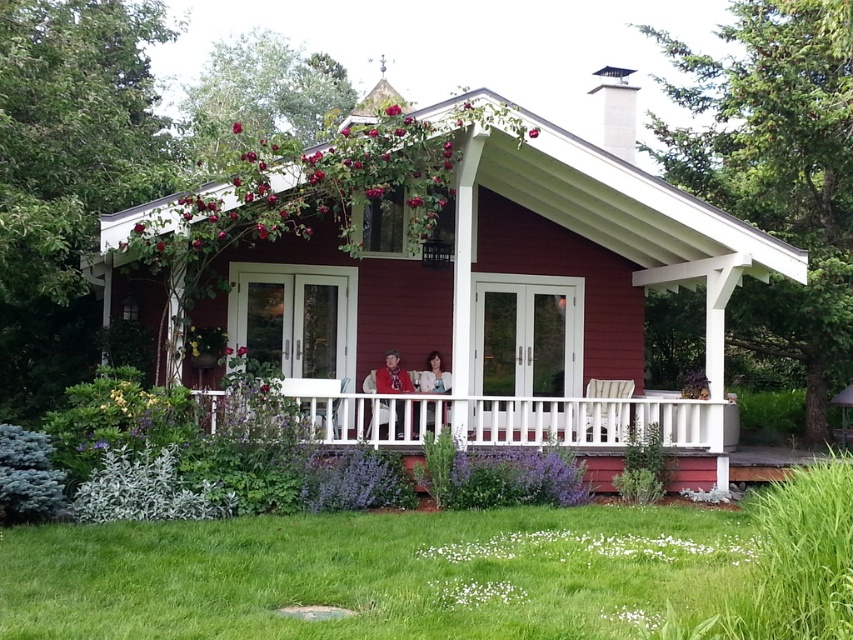
Question: Which of the following is the closest to the observer?

Choices:
 (A) red matte rose at center
 (B) white fluffy petals at lower center
 (C) green grass at lower center
 (D) white wooden porch at center

Answer: (C)

Question: Is white wooden porch at center bigger than smooth glossy rose at upper center?

Choices:
 (A) yes
 (B) no

Answer: (B)

Question: Is green grass at lower center bigger than red matte rose at center?

Choices:
 (A) no
 (B) yes

Answer: (B)

Question: Where is matte red cottage at center located in relation to deep red rose at center in the image?

Choices:
 (A) left
 (B) right

Answer: (B)

Question: Estimate the real-world distances between objects in this image. Which object is closer to the matte red cottage at center?

Choices:
 (A) pink matte rose at upper center
 (B) smooth glossy rose at upper center
 (C) matte red rose at upper center
 (D) red matte rose at upper center

Answer: (A)

Question: Based on their relative distances, which object is farther from the pink matte rose at upper center?

Choices:
 (A) red matte rose at center
 (B) green grass at lower center

Answer: (B)